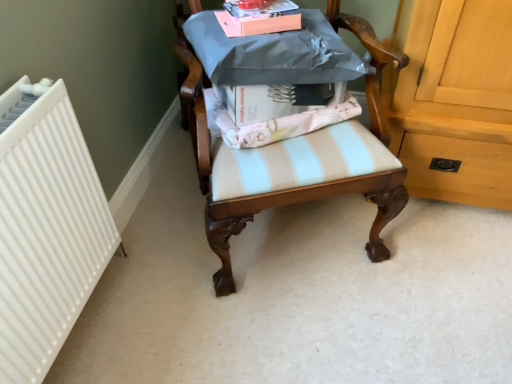
Find the location of a particular element. Image resolution: width=512 pixels, height=384 pixels. free point below white ribbed radiator at left (from a real-world perspective) is located at coordinates (140, 208).